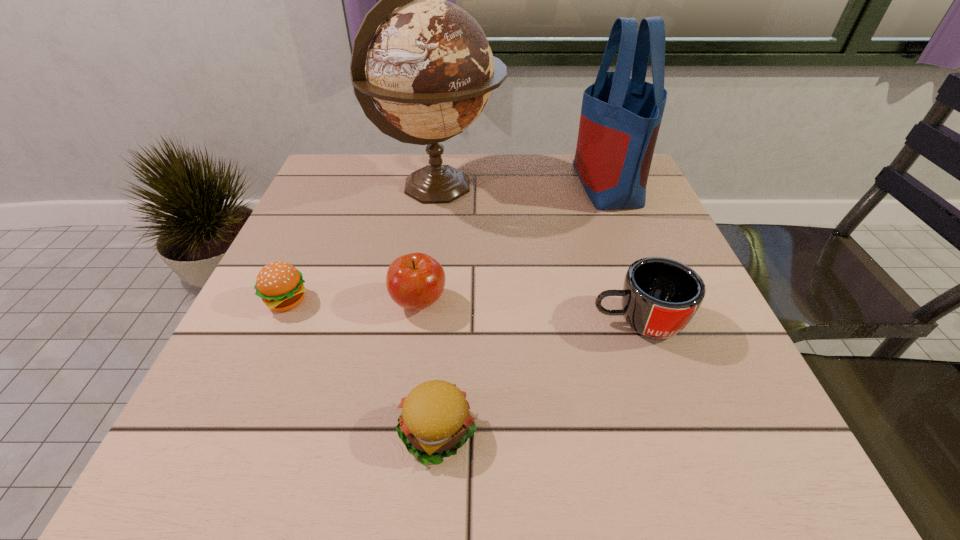
Where is `vacant space at the near right corner of the desktop`? The image size is (960, 540). vacant space at the near right corner of the desktop is located at coordinates (704, 431).

At what (x,y) coordinates should I click in order to perform the action: click on vacant space that's between the leftmost object and the mug. Please return your answer as a coordinate pair (x, y). Image resolution: width=960 pixels, height=540 pixels. Looking at the image, I should click on (462, 311).

Identify the location of free space between the mug and the farther hamburger. (462, 311).

Identify the location of empty space that is in between the mug and the handbag. The height and width of the screenshot is (540, 960). (622, 252).

Locate an element on the screen. The width and height of the screenshot is (960, 540). free space between the apple and the handbag is located at coordinates point(513,243).

Identify the location of empty space between the nearer hamburger and the apple. (428, 367).

At what (x,y) coordinates should I click in order to perform the action: click on empty location between the apple and the globe. Please return your answer as a coordinate pair (x, y). The image size is (960, 540). Looking at the image, I should click on (428, 245).

This screenshot has width=960, height=540. What are the coordinates of `vacant area that lies between the handbag and the nearest object` in the screenshot? It's located at (522, 308).

Find the location of a particular element. vacant region between the leftmost object and the mug is located at coordinates (462, 311).

The image size is (960, 540). What are the coordinates of `unoccupied position between the nearest object and the apple` in the screenshot? It's located at (428, 367).